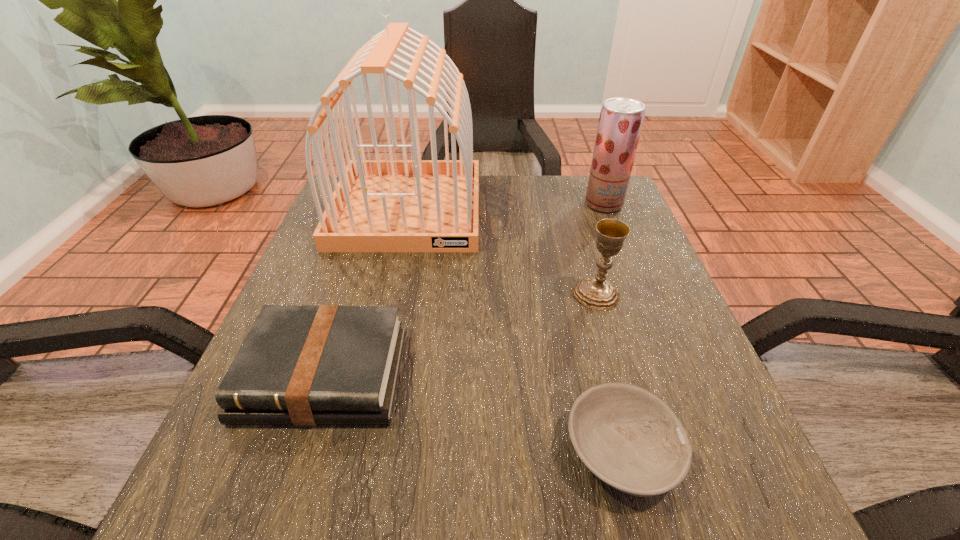
Image resolution: width=960 pixels, height=540 pixels. Identify the location of vacant space that satisfies the following two spatial constraints: 1. with an open door on the third tallest object; 2. on the right side of the tallest object. (388, 294).

What are the coordinates of `vacant space that satisfies the following two spatial constraints: 1. with an open door on the shortest object; 2. on the left side of the birdcage` in the screenshot? It's located at (352, 451).

The image size is (960, 540). Find the location of `free point that satisfies the following two spatial constraints: 1. on the spine side of the second shortest object; 2. on the right side of the shortest object`. free point that satisfies the following two spatial constraints: 1. on the spine side of the second shortest object; 2. on the right side of the shortest object is located at coordinates (300, 451).